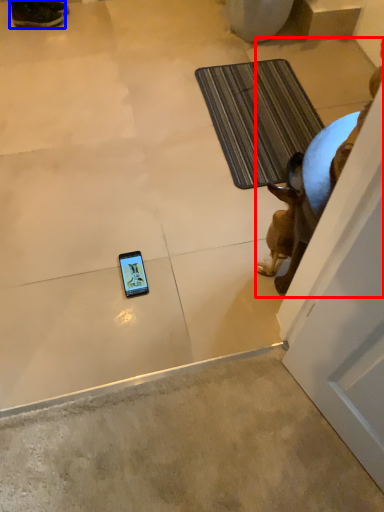
Question: Among these objects, which one is farthest to the camera, animal (highlighted by a red box) or footwear (highlighted by a blue box)?

Choices:
 (A) animal
 (B) footwear

Answer: (B)